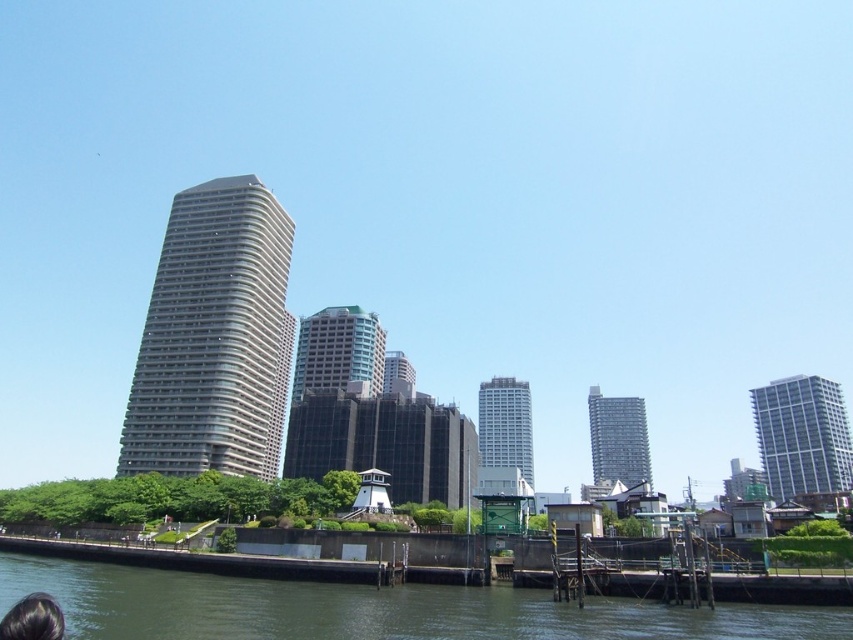
Question: Does gray glassy building at center appear on the left side of dark brown hair at lower left?

Choices:
 (A) no
 (B) yes

Answer: (B)

Question: Which of these objects is positioned farthest from the white glossy building at center?

Choices:
 (A) white glossy building at right
 (B) green concrete river at lower center
 (C) matte gray building at center

Answer: (B)

Question: Is gray glassy building at center positioned behind smooth gray building at center?

Choices:
 (A) yes
 (B) no

Answer: (B)

Question: Does white glossy building at center appear on the right side of matte gray building at center?

Choices:
 (A) no
 (B) yes

Answer: (B)

Question: Among these objects, which one is nearest to the camera?

Choices:
 (A) smooth gray building at center
 (B) dark brown hair at lower left
 (C) green concrete river at lower center
 (D) gray glassy building at center

Answer: (B)

Question: Considering the real-world distances, which object is closest to the green concrete river at lower center?

Choices:
 (A) gray glassy building at center
 (B) white glossy building at center

Answer: (A)